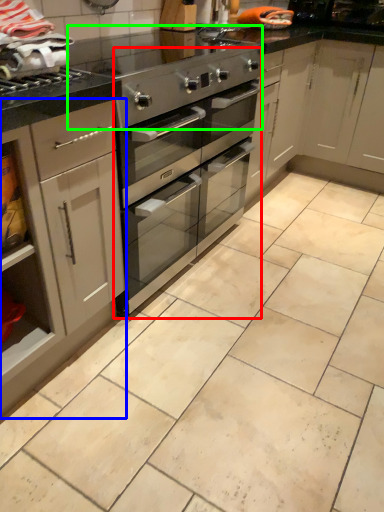
Question: Considering the real-world distances, which object is farthest from oven (highlighted by a red box)? cabinetry (highlighted by a blue box) or appliance (highlighted by a green box)?

Choices:
 (A) cabinetry
 (B) appliance

Answer: (A)